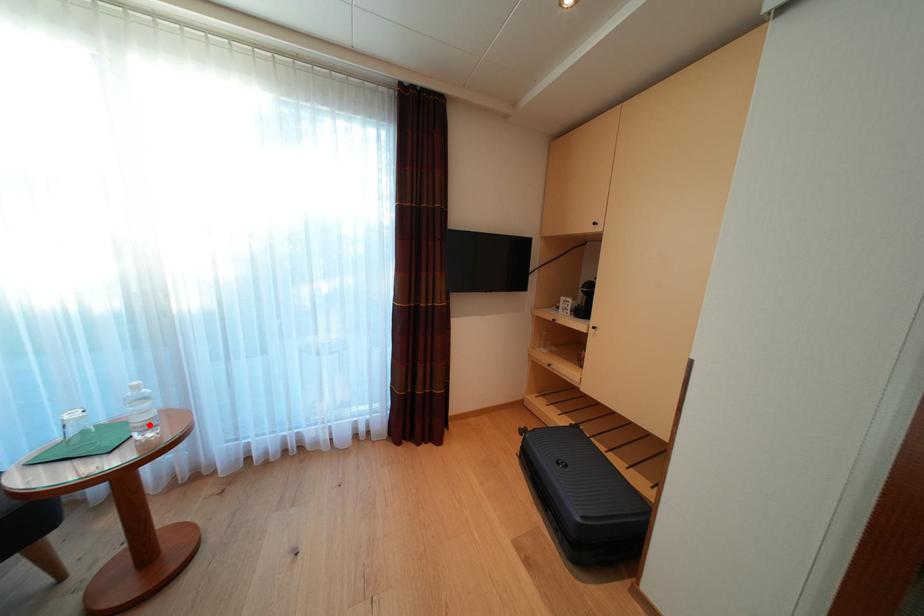
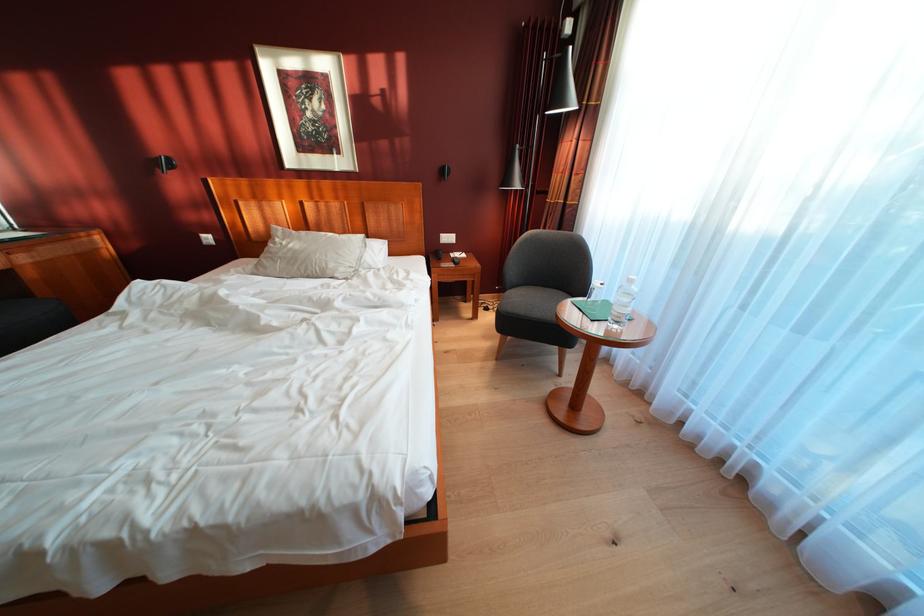
In the second image, find the point that corresponds to the highlighted location in the first image.

(625, 315)